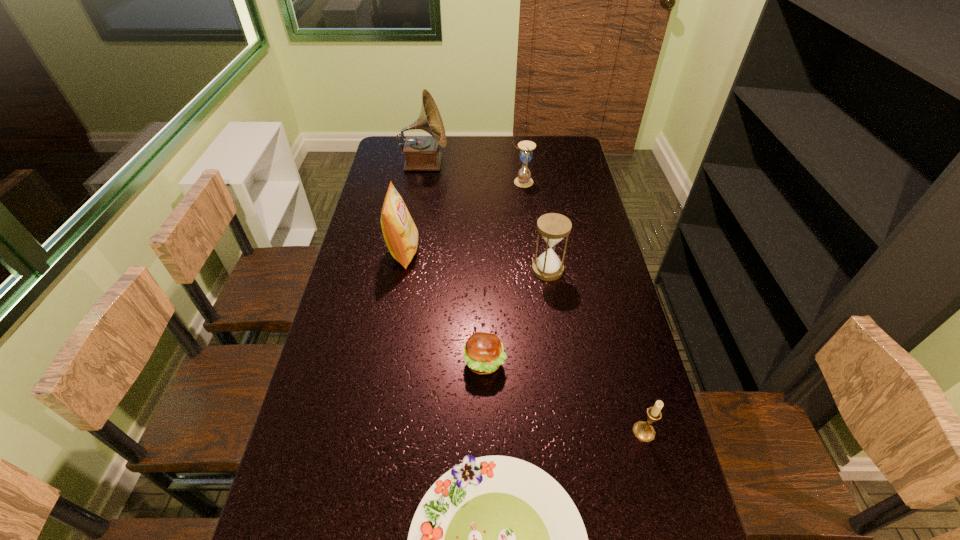
Image resolution: width=960 pixels, height=540 pixels. What are the coordinates of `vacant point located between the farther hourglass and the nearer hourglass` in the screenshot? It's located at (535, 226).

You are a GUI agent. You are given a task and a screenshot of the screen. Output one action in this format:
    pyautogui.click(x=<x>, y=<y>)
    Task: Click on the object identified as the fourth closest to the nearer hourglass
    Image resolution: width=960 pixels, height=540 pixels.
    Given the screenshot: What is the action you would take?
    pyautogui.click(x=643, y=431)

Select which object is the sixth closest to the farther hourglass. Please provide its 2D coordinates. Your answer should be formatted as a tuple, i.e. [(x, y)], where the tuple contains the x and y coordinates of a point satisfying the conditions above.

[(496, 539)]

At what (x,y) coordinates should I click in order to perform the action: click on vacant space that satisfies the following two spatial constraints: 1. on the horn of the farther hourglass; 2. on the right side of the phonograph record. Please return your answer as a coordinate pair (x, y). The width and height of the screenshot is (960, 540). Looking at the image, I should click on [421, 182].

The width and height of the screenshot is (960, 540). What are the coordinates of `vacant area in the image that satisfies the following two spatial constraints: 1. on the back side of the nearer hourglass; 2. on the horn of the phonograph record` in the screenshot? It's located at (532, 164).

Find the location of `vacant region that satisfies the following two spatial constraints: 1. on the horn of the fifth farthest object; 2. on the left side of the phonograph record`. vacant region that satisfies the following two spatial constraints: 1. on the horn of the fifth farthest object; 2. on the left side of the phonograph record is located at coordinates (392, 363).

At what (x,y) coordinates should I click in order to perform the action: click on free location that satisfies the following two spatial constraints: 1. on the horn of the hamburger; 2. on the left side of the tallest object. Please return your answer as a coordinate pair (x, y). This screenshot has height=540, width=960. Looking at the image, I should click on (392, 363).

Identify the location of vacant region that satisfies the following two spatial constraints: 1. on the horn of the phonograph record; 2. on the back side of the fifth tallest object. This screenshot has height=540, width=960. (380, 432).